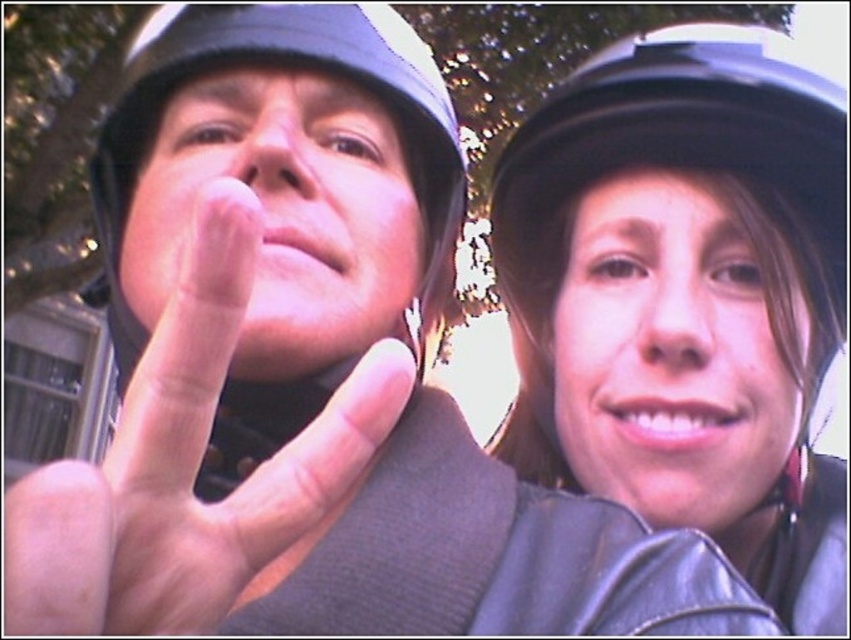
Question: From the image, what is the correct spatial relationship of black leather helmet at upper center in relation to matte black helmet at right?

Choices:
 (A) below
 (B) above

Answer: (B)

Question: Which of the following is the closest to the observer?

Choices:
 (A) black leather helmet at upper center
 (B) matte black helmet at center
 (C) matte black helmet at right
 (D) pink flesh-toned hand at center

Answer: (D)

Question: In this image, where is pink flesh-toned hand at center located relative to matte black helmet at right?

Choices:
 (A) left
 (B) right

Answer: (A)

Question: Does black leather helmet at upper center have a greater width compared to matte black helmet at right?

Choices:
 (A) yes
 (B) no

Answer: (A)

Question: Which object appears closest to the camera in this image?

Choices:
 (A) pink flesh-toned hand at center
 (B) matte black helmet at center

Answer: (A)

Question: Based on their relative distances, which object is farther from the matte black helmet at center?

Choices:
 (A) black leather helmet at upper center
 (B) pink flesh-toned hand at center

Answer: (A)